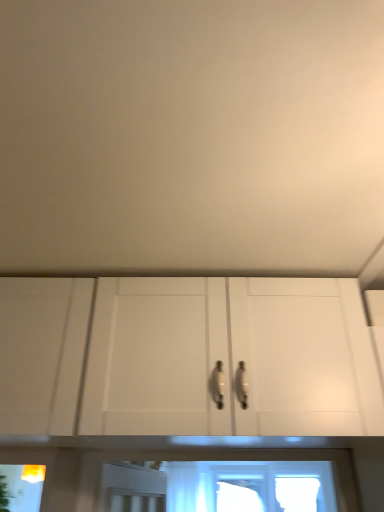
Question: Should I look upward or downward to see yellow plastic light fixture at lower left?

Choices:
 (A) up
 (B) down

Answer: (B)

Question: Is yellow plastic light fixture at lower left outside white matte cabinet at center?

Choices:
 (A) no
 (B) yes

Answer: (B)

Question: Can you confirm if yellow plastic light fixture at lower left is smaller than white matte cabinet at center?

Choices:
 (A) no
 (B) yes

Answer: (B)

Question: Is yellow plastic light fixture at lower left positioned in front of white matte cabinet at center?

Choices:
 (A) no
 (B) yes

Answer: (A)

Question: Is yellow plastic light fixture at lower left thinner than white matte cabinet at center?

Choices:
 (A) no
 (B) yes

Answer: (B)

Question: Is yellow plastic light fixture at lower left positioned behind white matte cabinet at center?

Choices:
 (A) yes
 (B) no

Answer: (A)

Question: From a real-world perspective, is yellow plastic light fixture at lower left positioned under white matte cabinet at center based on gravity?

Choices:
 (A) no
 (B) yes

Answer: (B)

Question: Can you confirm if green leafy plant at lower left is positioned to the right of yellow plastic light fixture at lower left?

Choices:
 (A) no
 (B) yes

Answer: (A)

Question: From the image's perspective, would you say green leafy plant at lower left is positioned over yellow plastic light fixture at lower left?

Choices:
 (A) yes
 (B) no

Answer: (B)

Question: Can you confirm if green leafy plant at lower left is taller than yellow plastic light fixture at lower left?

Choices:
 (A) no
 (B) yes

Answer: (B)

Question: Are green leafy plant at lower left and yellow plastic light fixture at lower left making contact?

Choices:
 (A) no
 (B) yes

Answer: (A)

Question: Would you consider green leafy plant at lower left to be distant from yellow plastic light fixture at lower left?

Choices:
 (A) yes
 (B) no

Answer: (B)

Question: Is green leafy plant at lower left at the left side of yellow plastic light fixture at lower left?

Choices:
 (A) no
 (B) yes

Answer: (B)

Question: From a real-world perspective, is white matte cabinet at center located beneath yellow plastic light fixture at lower left?

Choices:
 (A) yes
 (B) no

Answer: (B)